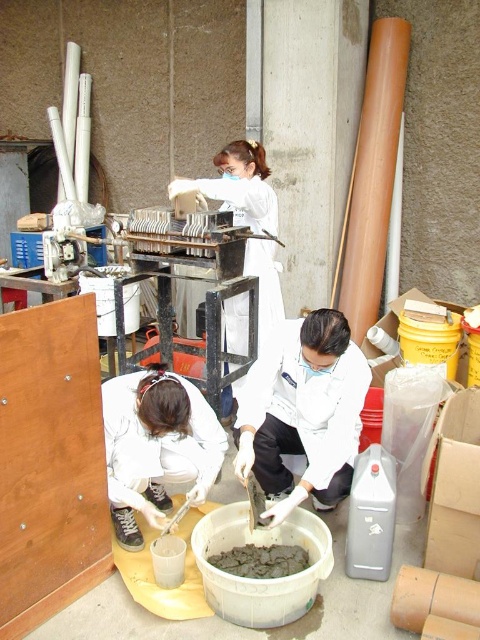
Question: Is white matte lab coat at center wider than white matte lab coat at lower left?

Choices:
 (A) no
 (B) yes

Answer: (B)

Question: Can you confirm if white matte lab coat at center is positioned below white matte lab coat at lower left?

Choices:
 (A) no
 (B) yes

Answer: (A)

Question: Which object is the farthest from the white matte lab coat at center?

Choices:
 (A) gray matte concrete at center
 (B) white matte lab coat at lower left

Answer: (A)

Question: Which object appears closest to the camera in this image?

Choices:
 (A) white matte lab coat at center
 (B) white matte lab coat at lower left

Answer: (A)

Question: Is white matte lab coat at center closer to camera compared to white matte lab coat at lower left?

Choices:
 (A) yes
 (B) no

Answer: (A)

Question: Based on their relative distances, which object is farther from the gray matte concrete at center?

Choices:
 (A) white matte lab coat at center
 (B) white matte lab coat at lower left

Answer: (B)